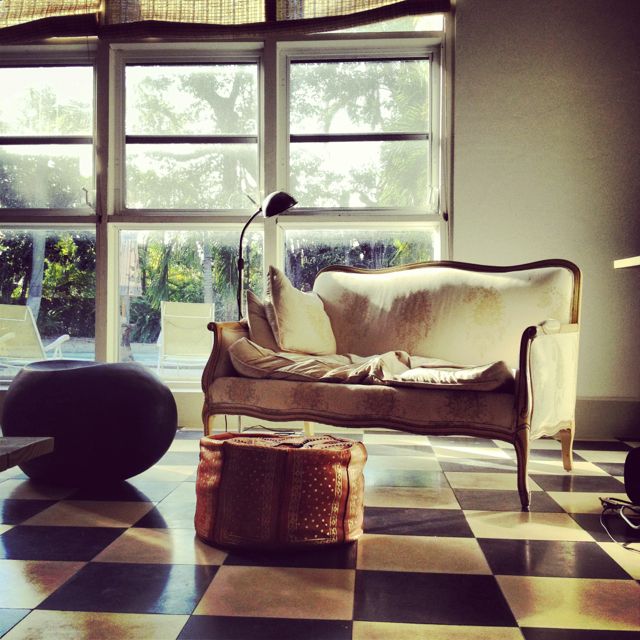
Find the location of a particular element. The image size is (640, 640). window is located at coordinates (214, 186).